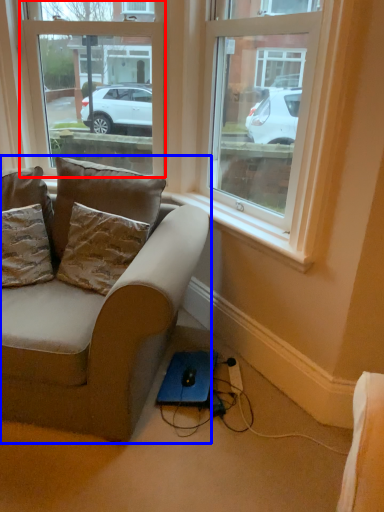
Question: Which object appears closest to the camera in this image, window (highlighted by a red box) or studio couch (highlighted by a blue box)?

Choices:
 (A) window
 (B) studio couch

Answer: (B)